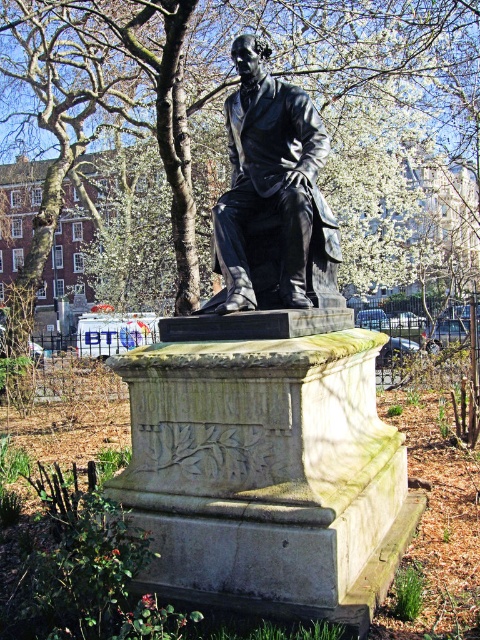
Question: Which object is closer to the camera taking this photo?

Choices:
 (A) black polished statue at center
 (B) green leafy tree at upper left
 (C) polished bronze statue at center

Answer: (C)

Question: Can you confirm if green leafy tree at upper left is bigger than polished bronze statue at center?

Choices:
 (A) no
 (B) yes

Answer: (B)

Question: Is green leafy tree at upper left bigger than black polished statue at center?

Choices:
 (A) no
 (B) yes

Answer: (B)

Question: Based on their relative distances, which object is nearer to the green leafy tree at upper left?

Choices:
 (A) black polished statue at center
 (B) polished bronze statue at center

Answer: (B)

Question: Estimate the real-world distances between objects in this image. Which object is closer to the green leafy tree at upper left?

Choices:
 (A) black polished statue at center
 (B) polished bronze statue at center

Answer: (B)

Question: Is green leafy tree at upper left smaller than polished bronze statue at center?

Choices:
 (A) yes
 (B) no

Answer: (B)